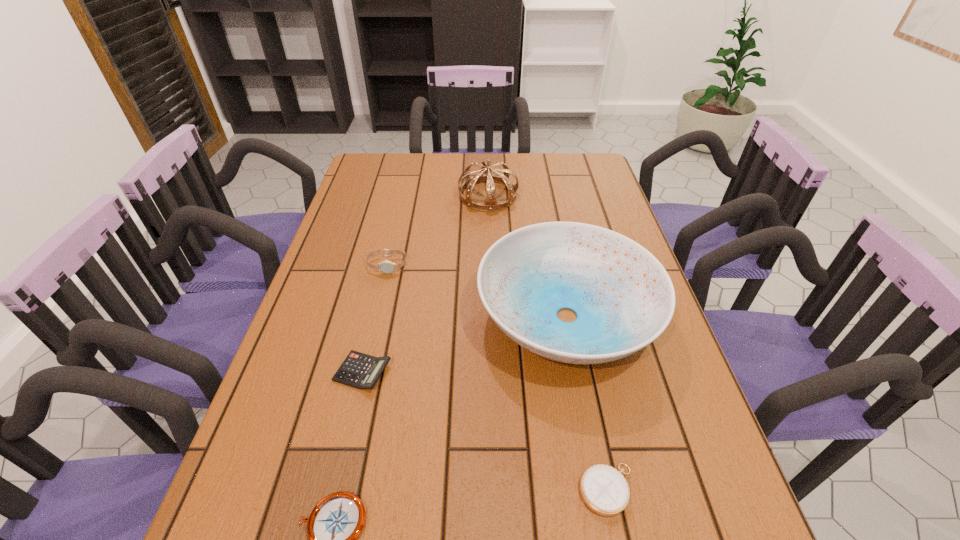
Find the location of a particular element. object located at the far edge is located at coordinates (485, 174).

Locate an element on the screen. This screenshot has height=540, width=960. watch at the left edge is located at coordinates (387, 267).

Where is `calculator that is at the left edge`? The image size is (960, 540). calculator that is at the left edge is located at coordinates (361, 371).

Identify the location of object that is at the right edge. Image resolution: width=960 pixels, height=540 pixels. (624, 299).

In the image, there is a desktop. Where is `vacant area at the far edge`? vacant area at the far edge is located at coordinates (519, 175).

This screenshot has height=540, width=960. In the image, there is a desktop. Find the location of `vacant space at the left edge`. vacant space at the left edge is located at coordinates tap(322, 269).

The image size is (960, 540). I want to click on free location at the right edge, so point(587,204).

The height and width of the screenshot is (540, 960). In order to click on vacant space at the far right corner of the desktop in this screenshot , I will do `click(601, 167)`.

Identify the location of free space that is in between the calculator and the dish. The width and height of the screenshot is (960, 540). (465, 344).

Identify the location of free space between the tiara and the calculator. (425, 284).